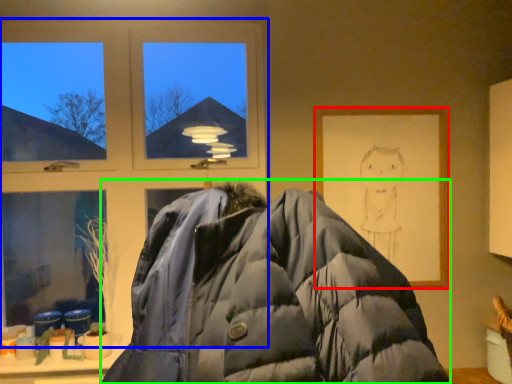
Question: Based on their relative distances, which object is farther from picture frame (highlighted by a red box)? Choose from window (highlighted by a blue box) and jacket (highlighted by a green box).

Choices:
 (A) window
 (B) jacket

Answer: (B)